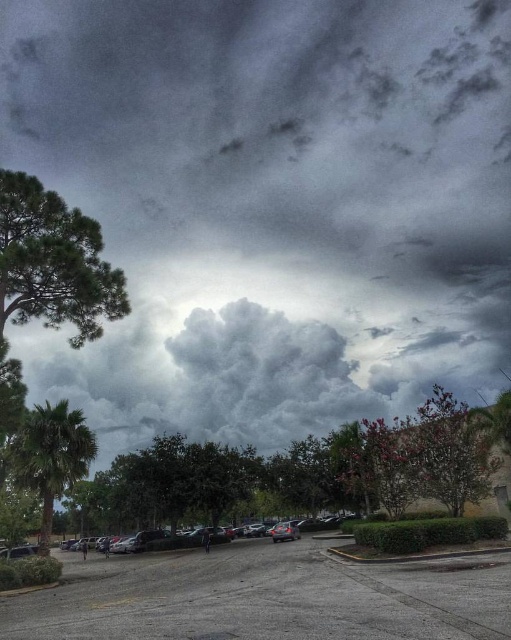
Does gray asphalt parking lot at lower center have a greater width compared to green leafy tree at left?

Correct, the width of gray asphalt parking lot at lower center exceeds that of green leafy tree at left.

Does gray asphalt parking lot at lower center have a lesser height compared to green leafy tree at left?

Correct, gray asphalt parking lot at lower center is not as tall as green leafy tree at left.

Which is in front, point (446, 588) or point (9, 250)?

Positioned in front is point (446, 588).

Identify the location of gray asphalt parking lot at lower center. coord(265,596).

Locate an element on the screen. green leafy tree at left is located at coordinates (49, 301).

Which is more to the right, green leafy tree at left or green leafy palm at left?

green leafy tree at left

Is point (2, 412) farther from camera compared to point (79, 424)?

No, (2, 412) is closer to viewer.

Where is `green leafy tree at left`? green leafy tree at left is located at coordinates (49, 301).

Between gray asphalt parking lot at lower center and green leafy palm at left, which one appears on the right side from the viewer's perspective?

Positioned to the right is gray asphalt parking lot at lower center.

Who is positioned more to the left, gray asphalt parking lot at lower center or green leafy palm at left?

From the viewer's perspective, green leafy palm at left appears more on the left side.

The height and width of the screenshot is (640, 511). Identify the location of gray asphalt parking lot at lower center. (265, 596).

Where is `gray asphalt parking lot at lower center`? gray asphalt parking lot at lower center is located at coordinates (265, 596).